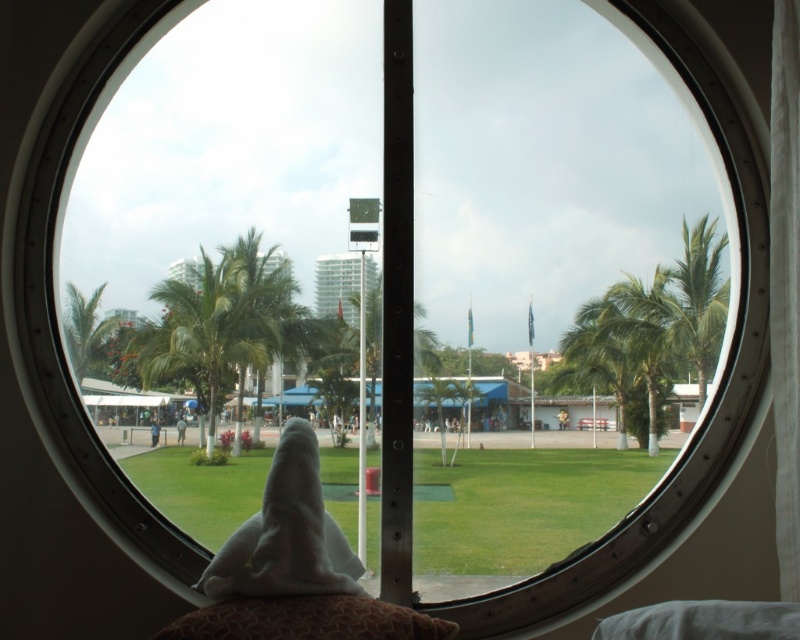
Question: Which point is closer to the camera taking this photo?

Choices:
 (A) (84, 310)
 (B) (774, 221)
 (C) (710, 289)

Answer: (B)

Question: Does white textured curtain at center have a smaller size compared to green leafy palm tree at lower left?

Choices:
 (A) no
 (B) yes

Answer: (B)

Question: Is white textured curtain at center wider than white fluffy towel at center?

Choices:
 (A) yes
 (B) no

Answer: (B)

Question: Which of the following is the farthest from the observer?

Choices:
 (A) (684, 316)
 (B) (774, 269)

Answer: (A)

Question: Which of the following is the farthest from the observer?

Choices:
 (A) white fluffy towel at center
 (B) green leafy palm tree at lower left
 (C) green leafy palm tree at center-right

Answer: (C)

Question: Does green leafy palm tree at right appear under green leafy palm tree at lower left?

Choices:
 (A) no
 (B) yes

Answer: (A)